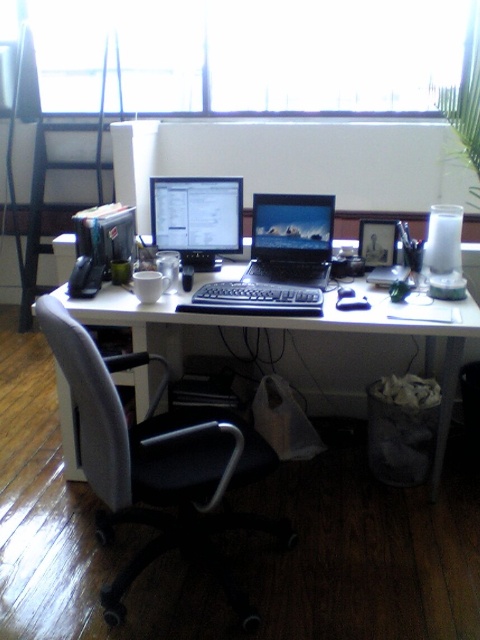
Question: Which point is farther to the camera?

Choices:
 (A) white plastic computer desk at center
 (B) matte black monitor at center

Answer: (B)

Question: From the image, what is the correct spatial relationship of transparent glass window at upper center in relation to matte black monitor at center?

Choices:
 (A) right
 (B) left

Answer: (A)

Question: Which object is positioned farthest from the shiny black laptop at center?

Choices:
 (A) white plastic computer desk at center
 (B) matte black monitor at center

Answer: (A)

Question: Considering the real-world distances, which object is farthest from the gray fabric swivel chair at center?

Choices:
 (A) matte black monitor at center
 (B) transparent glass window at upper center
 (C) white plastic computer desk at center
 (D) shiny black laptop at center

Answer: (B)

Question: Considering the relative positions of transparent glass window at upper center and white plastic computer desk at center in the image provided, where is transparent glass window at upper center located with respect to white plastic computer desk at center?

Choices:
 (A) right
 (B) left

Answer: (B)

Question: Is white plastic computer desk at center bigger than shiny black laptop at center?

Choices:
 (A) yes
 (B) no

Answer: (A)